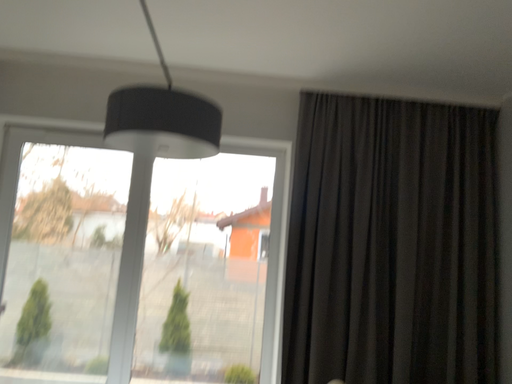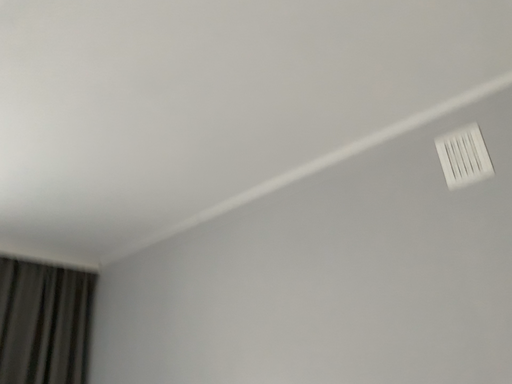
Question: How did the camera likely rotate when shooting the video?

Choices:
 (A) rotated right
 (B) rotated left

Answer: (A)